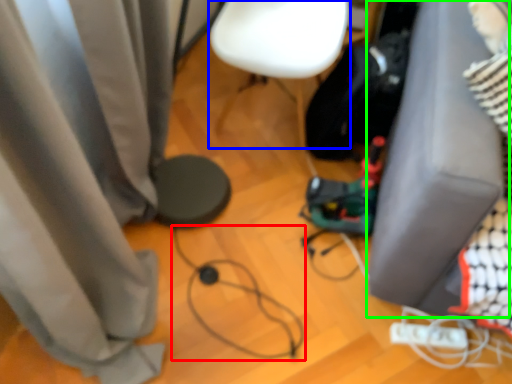
Question: Which object is positioned farthest from wire (highlighted by a red box)? Select from armchair (highlighted by a blue box) and furniture (highlighted by a green box).

Choices:
 (A) armchair
 (B) furniture

Answer: (A)